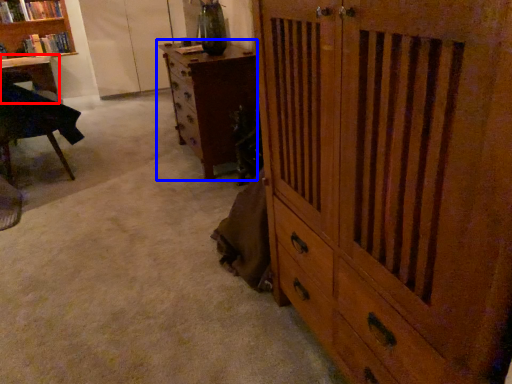
Question: Among these objects, which one is nearest to the camera, desk (highlighted by a red box) or chest of drawers (highlighted by a blue box)?

Choices:
 (A) desk
 (B) chest of drawers

Answer: (B)